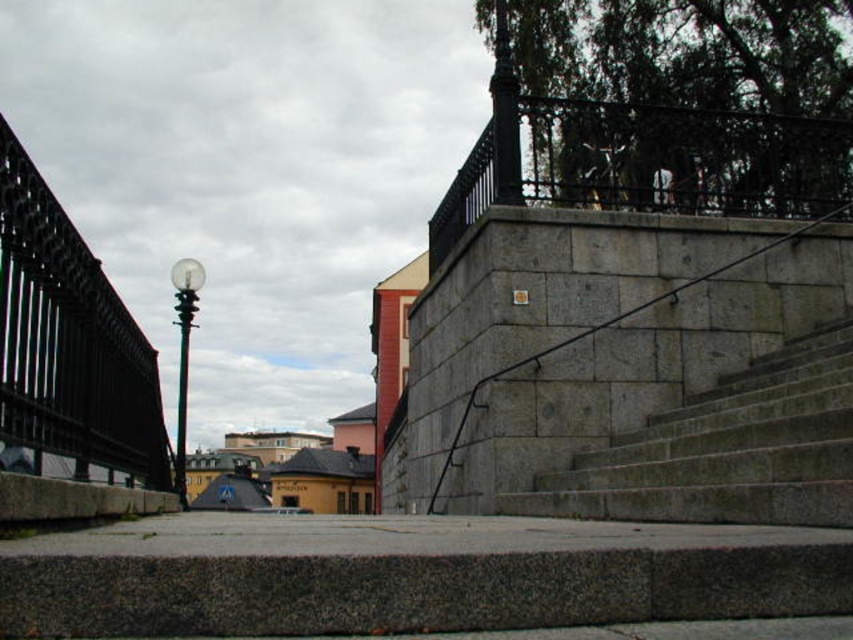
Question: Is gray stone steps at center above gray concrete at lower center?

Choices:
 (A) yes
 (B) no

Answer: (A)

Question: Which of the following is the closest to the observer?

Choices:
 (A) (787, 272)
 (B) (635, 433)

Answer: (B)

Question: Is gray stone steps at center below gray concrete at lower center?

Choices:
 (A) yes
 (B) no

Answer: (B)

Question: Which object appears farthest from the camera in this image?

Choices:
 (A) gray stone stairs at center
 (B) gray concrete at lower center

Answer: (A)

Question: Can you confirm if gray stone steps at center is wider than gray stone stairs at center?

Choices:
 (A) yes
 (B) no

Answer: (B)

Question: Considering the real-world distances, which object is closest to the gray stone stairs at center?

Choices:
 (A) gray stone steps at center
 (B) gray concrete at lower center

Answer: (B)